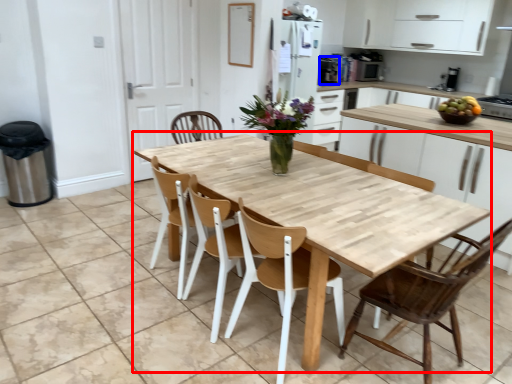
Question: Which of the following is the closest to the observer, kitchen & dining room table (highlighted by a red box) or appliance (highlighted by a blue box)?

Choices:
 (A) kitchen & dining room table
 (B) appliance

Answer: (A)